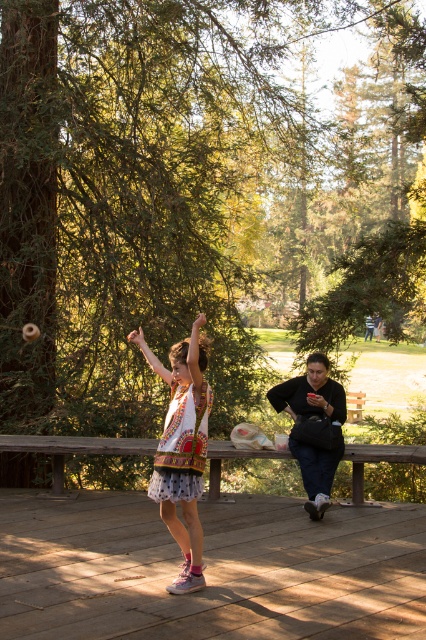
You are standing on the wooden deck at lower center and want to place a large picnic basket next to the white printed dress at center. Can you fit the basket there without moving the dress?

The wooden deck at lower center might be wider than the white printed dress at center, so there could be enough space to place the picnic basket next to the dress without moving it.